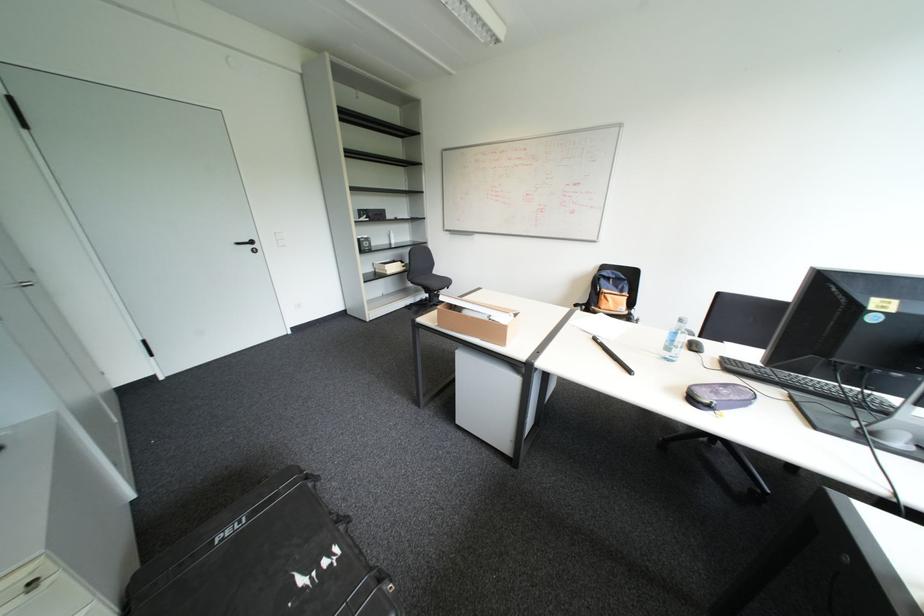
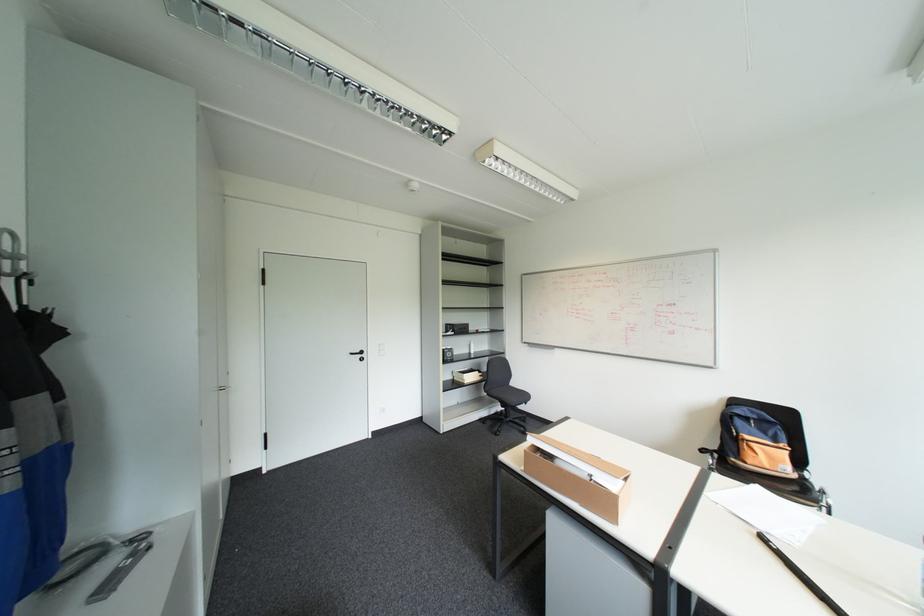
In the second image, find the point that corresponds to pixel 424 291 in the first image.

(500, 400)